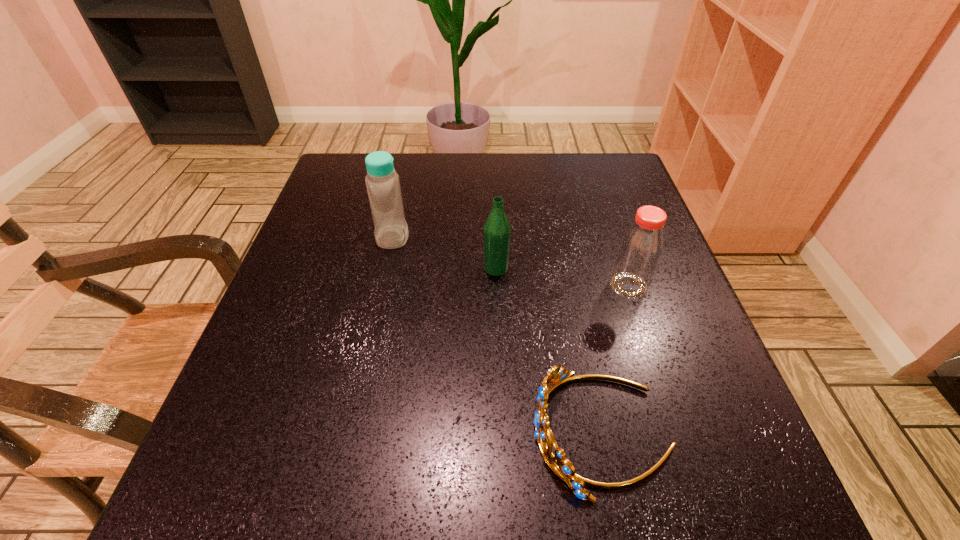
Where is `free spot between the farthest object and the rightmost bottle`? The image size is (960, 540). free spot between the farthest object and the rightmost bottle is located at coordinates pyautogui.click(x=511, y=261).

In order to click on object that stands as the second closest to the rightmost bottle in this screenshot , I will do `click(497, 232)`.

Locate which object ranks in proximity to the rightmost bottle. Please provide its 2D coordinates. Your answer should be formatted as a tuple, i.e. [(x, y)], where the tuple contains the x and y coordinates of a point satisfying the conditions above.

[(560, 465)]

I want to click on bottle that is the second nearest to the second bottle from right to left, so click(x=641, y=246).

Identify the location of bottle object that ranks as the closest to the leftmost object. (497, 232).

Identify the location of blank space that satisfies the following two spatial constraints: 1. on the front side of the rightmost bottle; 2. on the right side of the second bottle from right to left. (496, 286).

Identify the location of vacant space that satisfies the following two spatial constraints: 1. on the front side of the leftmost bottle; 2. on the left side of the rightmost bottle. The height and width of the screenshot is (540, 960). (382, 286).

You are a GUI agent. You are given a task and a screenshot of the screen. Output one action in this format:
    pyautogui.click(x=<x>, y=<y>)
    Task: Click on the vacant space that satisfies the following two spatial constraints: 1. on the front side of the rightmost bottle; 2. on the front-facing side of the shortest object
    This screenshot has width=960, height=540.
    Given the screenshot: What is the action you would take?
    pyautogui.click(x=677, y=433)

This screenshot has width=960, height=540. I want to click on vacant area that satisfies the following two spatial constraints: 1. on the front side of the rightmost bottle; 2. on the right side of the leftmost bottle, so click(x=382, y=286).